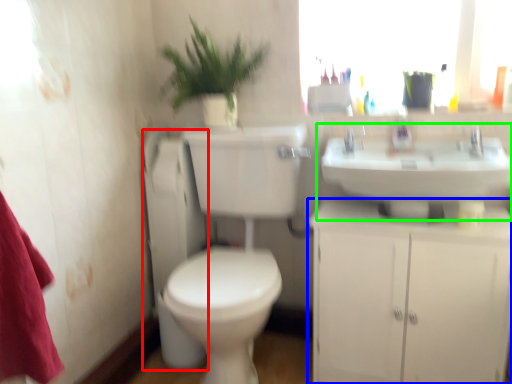
Question: Considering the real-world distances, which object is closest to appliance (highlighted by a red box)? bathroom cabinet (highlighted by a blue box) or sink (highlighted by a green box).

Choices:
 (A) bathroom cabinet
 (B) sink

Answer: (A)